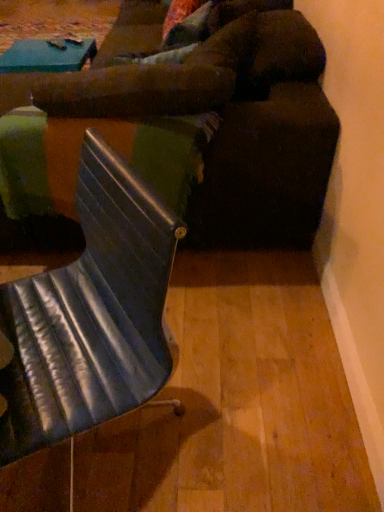
You are a GUI agent. You are given a task and a screenshot of the screen. Output one action in this format:
    pyautogui.click(x=<x>, y=<y>)
    Task: Click on the free point below metallic blue chair at center (from a real-world perspective)
    
    Given the screenshot: What is the action you would take?
    pyautogui.click(x=133, y=434)